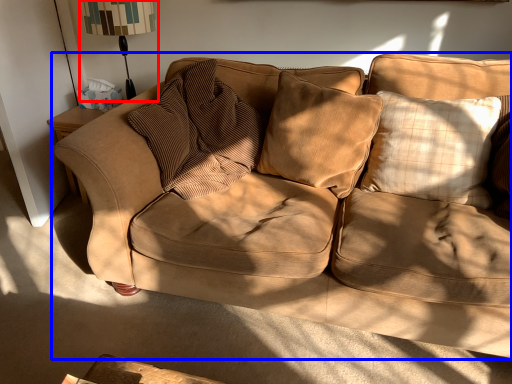
Question: Among these objects, which one is nearest to the camera, table lamp (highlighted by a red box) or studio couch (highlighted by a blue box)?

Choices:
 (A) table lamp
 (B) studio couch

Answer: (B)